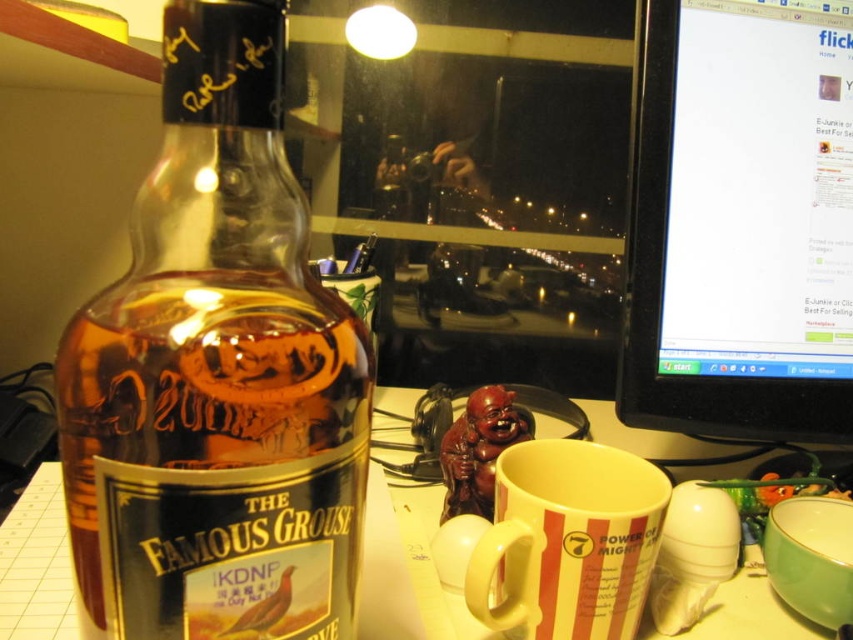
Question: Which of the following is the farthest from the observer?

Choices:
 (A) white striped mug at center
 (B) black glossy monitor at right

Answer: (B)

Question: Is black glossy monitor at right in front of white striped mug at center?

Choices:
 (A) no
 (B) yes

Answer: (A)

Question: Observing the image, what is the correct spatial positioning of translucent glass bottle at left in reference to white striped mug at center?

Choices:
 (A) below
 (B) above

Answer: (B)

Question: Which object is positioned closest to the white glossy table at lower center?

Choices:
 (A) translucent glass bottle at left
 (B) white striped mug at center
 (C) black glossy monitor at right

Answer: (B)

Question: Which object is farther from the camera taking this photo?

Choices:
 (A) black glossy monitor at right
 (B) white striped mug at center
 (C) white glossy table at lower center
 (D) translucent glass bottle at left

Answer: (A)

Question: Can you confirm if translucent glass bottle at left is thinner than white striped mug at center?

Choices:
 (A) yes
 (B) no

Answer: (A)